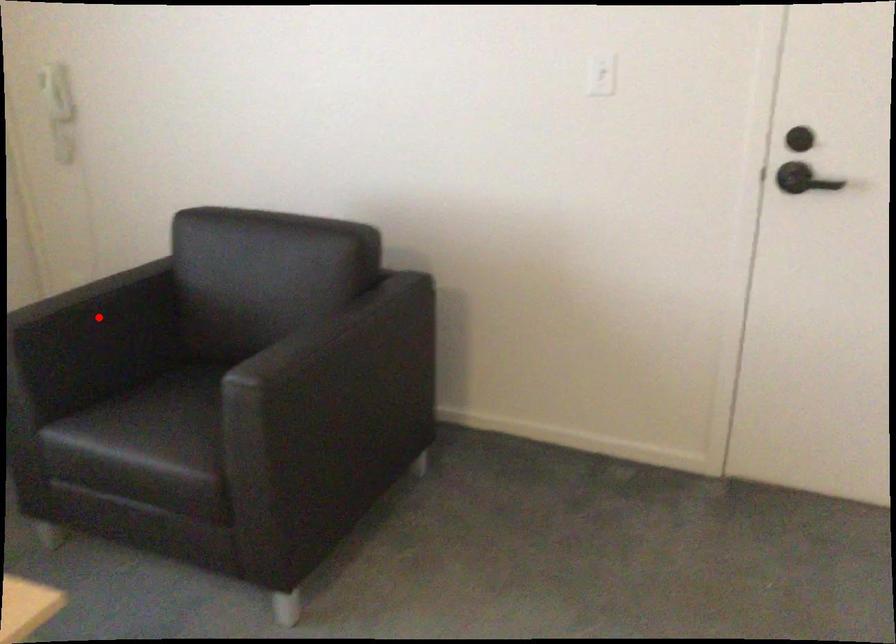
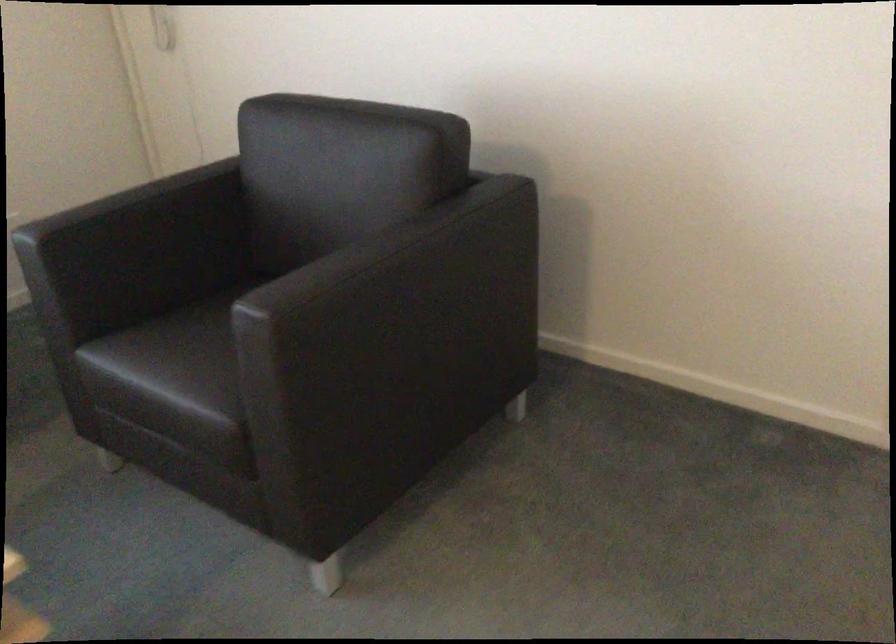
Locate, in the second image, the point that corresponds to the highlighted location in the first image.

(147, 225)